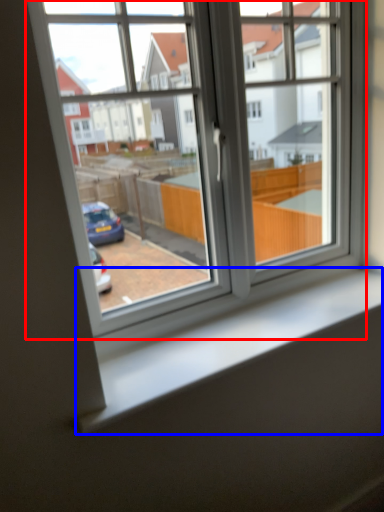
Question: Which object is further to the camera taking this photo, window (highlighted by a red box) or window sill (highlighted by a blue box)?

Choices:
 (A) window
 (B) window sill

Answer: (B)